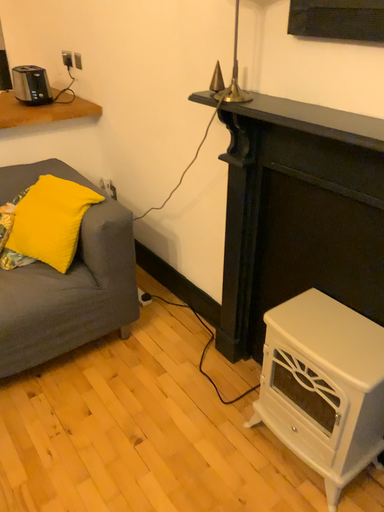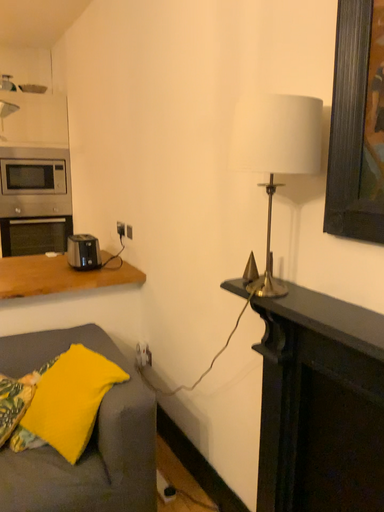
Question: Which way did the camera rotate in the video?

Choices:
 (A) rotated upward
 (B) rotated downward

Answer: (A)